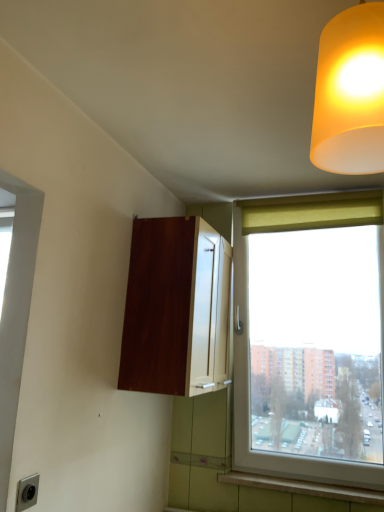
Question: Does wooden window sill at lower right have a lesser height compared to matte yellow curtain at upper right?

Choices:
 (A) yes
 (B) no

Answer: (A)

Question: Does wooden window sill at lower right have a greater width compared to matte yellow curtain at upper right?

Choices:
 (A) no
 (B) yes

Answer: (A)

Question: Is matte yellow curtain at upper right completely or partially inside wooden window sill at lower right?

Choices:
 (A) yes
 (B) no

Answer: (B)

Question: Is wooden window sill at lower right at the right side of matte yellow curtain at upper right?

Choices:
 (A) no
 (B) yes

Answer: (A)

Question: Is wooden window sill at lower right closer to camera compared to matte yellow curtain at upper right?

Choices:
 (A) no
 (B) yes

Answer: (B)

Question: Can you confirm if wooden window sill at lower right is taller than matte yellow curtain at upper right?

Choices:
 (A) no
 (B) yes

Answer: (A)

Question: Is matte yellow lampshade at upper right placed right next to matte yellow curtain at upper right?

Choices:
 (A) yes
 (B) no

Answer: (B)

Question: From a real-world perspective, is matte yellow lampshade at upper right beneath matte yellow curtain at upper right?

Choices:
 (A) no
 (B) yes

Answer: (B)

Question: From the image's perspective, is matte yellow lampshade at upper right located beneath matte yellow curtain at upper right?

Choices:
 (A) no
 (B) yes

Answer: (A)

Question: Is matte yellow lampshade at upper right to the right of matte yellow curtain at upper right from the viewer's perspective?

Choices:
 (A) no
 (B) yes

Answer: (A)

Question: Is matte yellow lampshade at upper right turned away from matte yellow curtain at upper right?

Choices:
 (A) no
 (B) yes

Answer: (A)

Question: Is matte yellow lampshade at upper right oriented towards matte yellow curtain at upper right?

Choices:
 (A) no
 (B) yes

Answer: (A)

Question: Is matte yellow curtain at upper right completely or partially inside matte gray electric outlet at lower left?

Choices:
 (A) no
 (B) yes

Answer: (A)